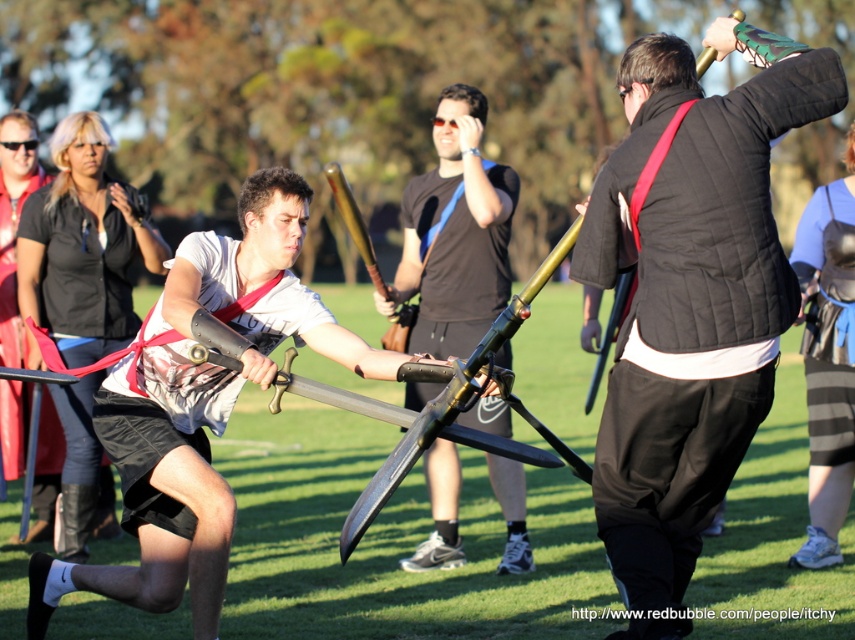
Between matte black padded armor at center and matte black sword at center, which one has more height?

matte black padded armor at center is taller.

Does matte black padded armor at center have a lesser height compared to matte black sword at center?

No, matte black padded armor at center is not shorter than matte black sword at center.

From the picture: Who is more distant from viewer, (647, 108) or (496, 408)?

Positioned behind is point (496, 408).

Identify the location of matte black padded armor at center. The width and height of the screenshot is (855, 640). (690, 298).

The width and height of the screenshot is (855, 640). What do you see at coordinates (453, 234) in the screenshot?
I see `matte black sword at center` at bounding box center [453, 234].

Between point (497, 493) and point (844, 268), which one is positioned behind?

The point (497, 493) is more distant.

The image size is (855, 640). I want to click on matte black sword at center, so click(453, 234).

Can you confirm if matte black padded armor at center is taller than matte white shirt at left?

In fact, matte black padded armor at center may be shorter than matte white shirt at left.

Is matte black padded armor at center closer to camera compared to matte white shirt at left?

Yes, matte black padded armor at center is in front of matte white shirt at left.

What do you see at coordinates (690, 298) in the screenshot? This screenshot has width=855, height=640. I see `matte black padded armor at center` at bounding box center [690, 298].

You are a GUI agent. You are given a task and a screenshot of the screen. Output one action in this format:
    pyautogui.click(x=<x>, y=<y>)
    Task: Click on the matte black padded armor at center
    The height and width of the screenshot is (640, 855).
    Given the screenshot: What is the action you would take?
    pyautogui.click(x=690, y=298)